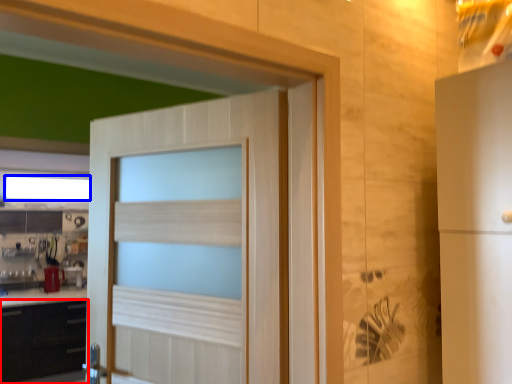
Question: Which point is closer to the camera, cabinetry (highlighted by a red box) or window (highlighted by a blue box)?

Choices:
 (A) cabinetry
 (B) window

Answer: (A)